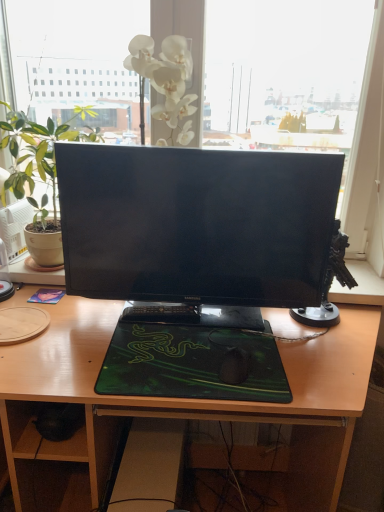
At what (x,y) coordinates should I click in order to perform the action: click on vacant space situated on the left part of black plastic keyboard at center. Please return your answer as a coordinate pair (x, y). Looking at the image, I should click on (100, 323).